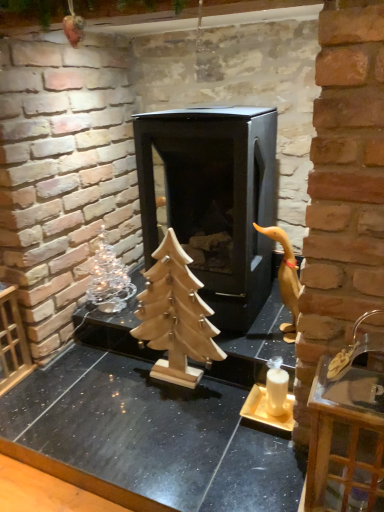
Identify the location of vacant space that is in between wooden christmas tree at center and white matte candle holder at lower right. Image resolution: width=384 pixels, height=512 pixels. (207, 399).